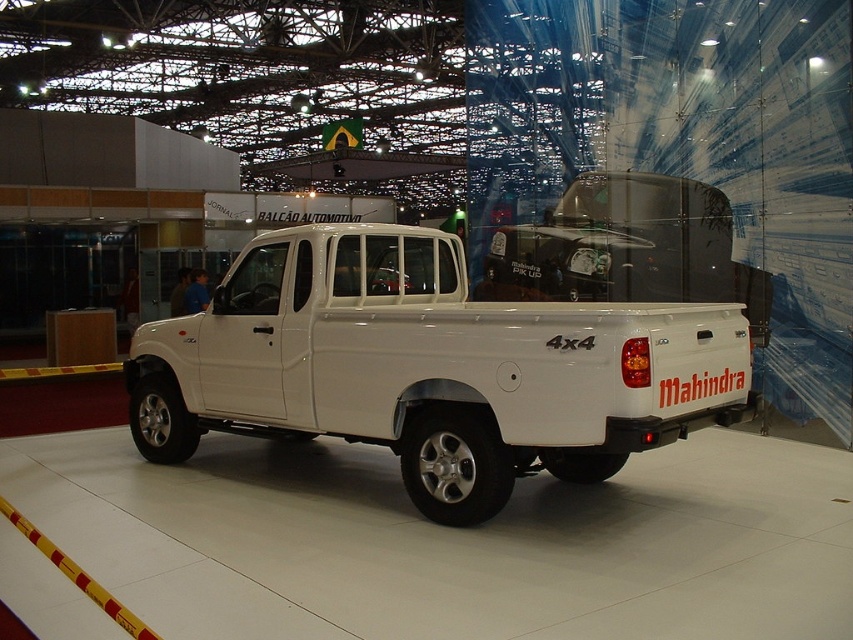
Based on the photo, you are at the auto show and want to take a photo of the white glossy pickup truck at center. If you stand directly in front of the truck, which direction should you move to align your camera with the truck?

Since the white glossy pickup truck at center is located at point coordinates, you should move to the center of the exhibition floor to align your camera with the truck.

You are standing at the point marked by the camera in the image. You want to walk to the point labeled point (x=595, y=353). How far will you have to walk in feet?

The distance between the camera and point (x=595, y=353) is 14.27 feet, so you will have to walk 14.27 feet to reach the point.